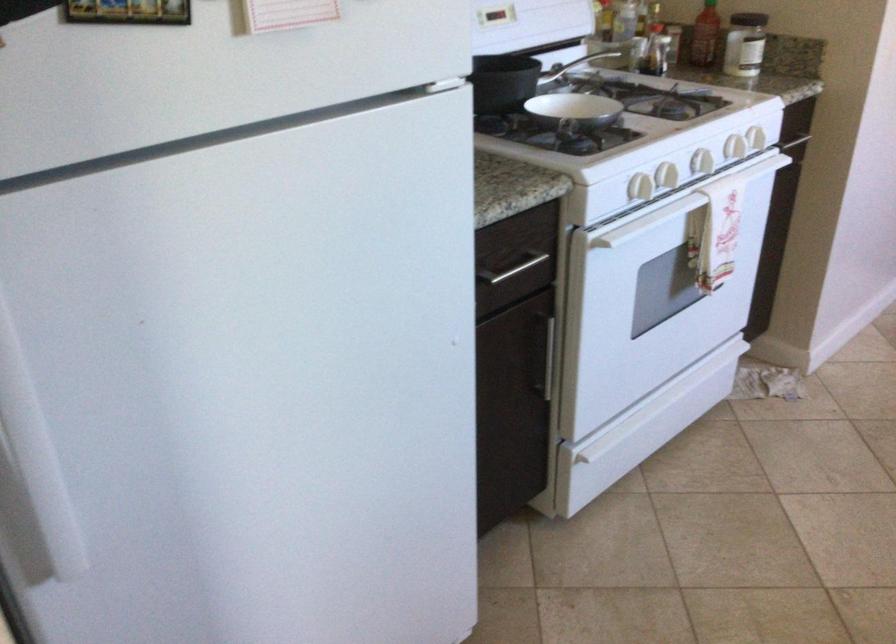
This screenshot has height=644, width=896. Find the location of `silver drawer handle`. silver drawer handle is located at coordinates (512, 268).